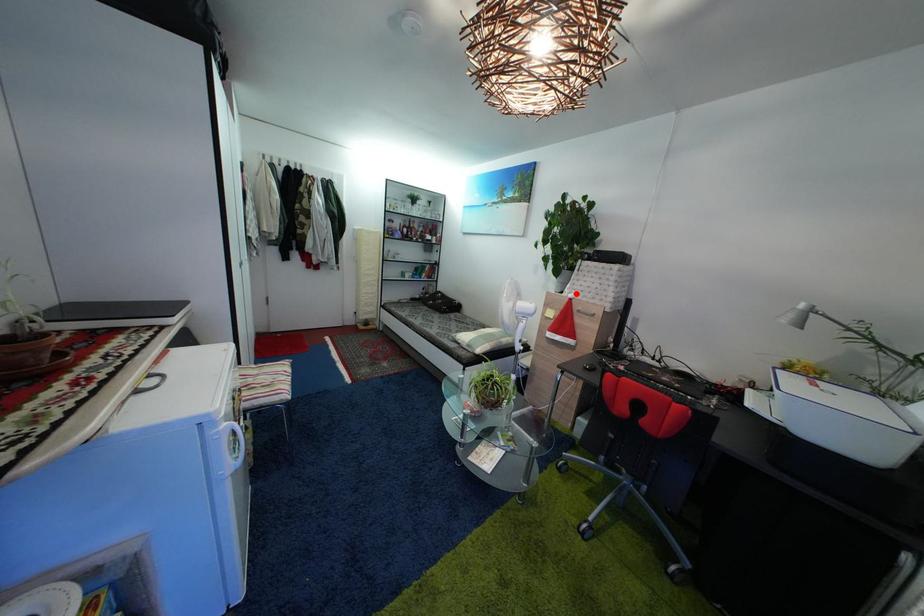
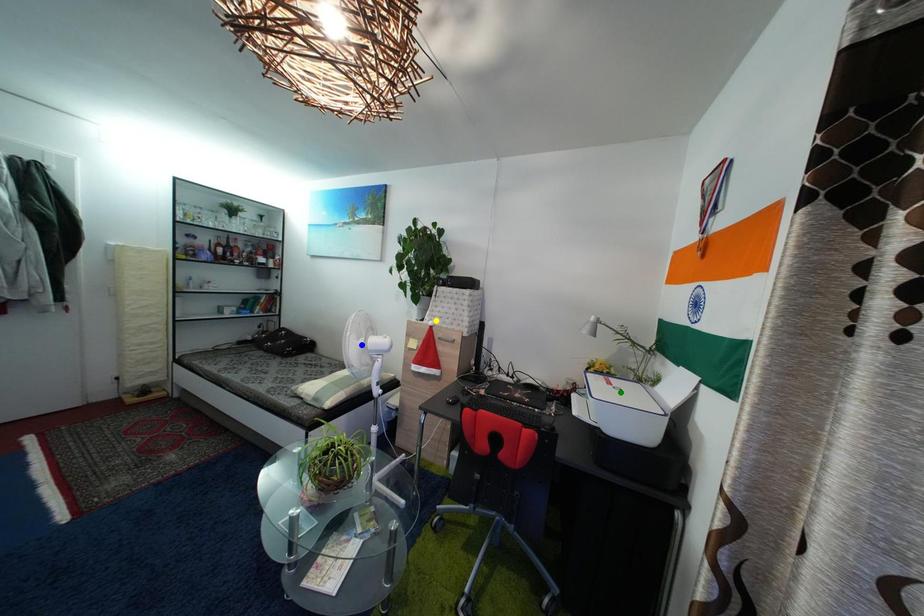
Question: I am providing you with two images of the same scene from different viewpoints. A red point is marked on the first image. You are given multiple points on the second image. Which point in image 2 is actually the same real-world point as the red point in image 1?

Choices:
 (A) green point
 (B) yellow point
 (C) blue point

Answer: (B)